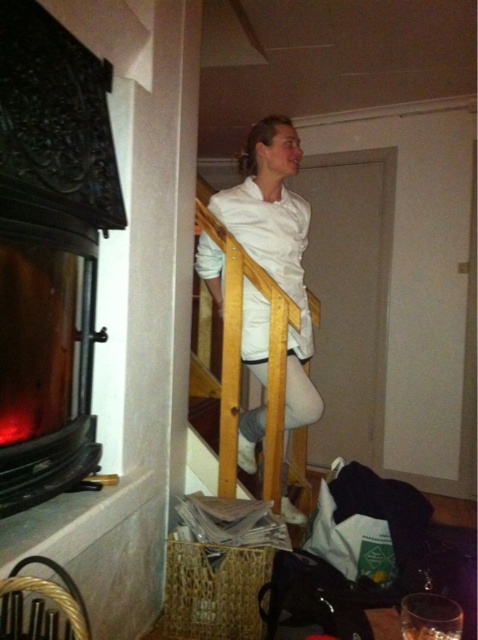
Describe the element at coordinates (45, 360) in the screenshot. I see `matte black fireplace at left` at that location.

Does matte black fireplace at left appear on the left side of white matte shirt at center?

Correct, you'll find matte black fireplace at left to the left of white matte shirt at center.

You are a GUI agent. You are given a task and a screenshot of the screen. Output one action in this format:
    pyautogui.click(x=<x>, y=<y>)
    Task: Click on the matte black fireplace at left
    
    Given the screenshot: What is the action you would take?
    pyautogui.click(x=45, y=360)

At what (x,y) coordinates should I click in order to perform the action: click on matte black fireplace at left. Please return your answer as a coordinate pair (x, y). Looking at the image, I should click on (45, 360).